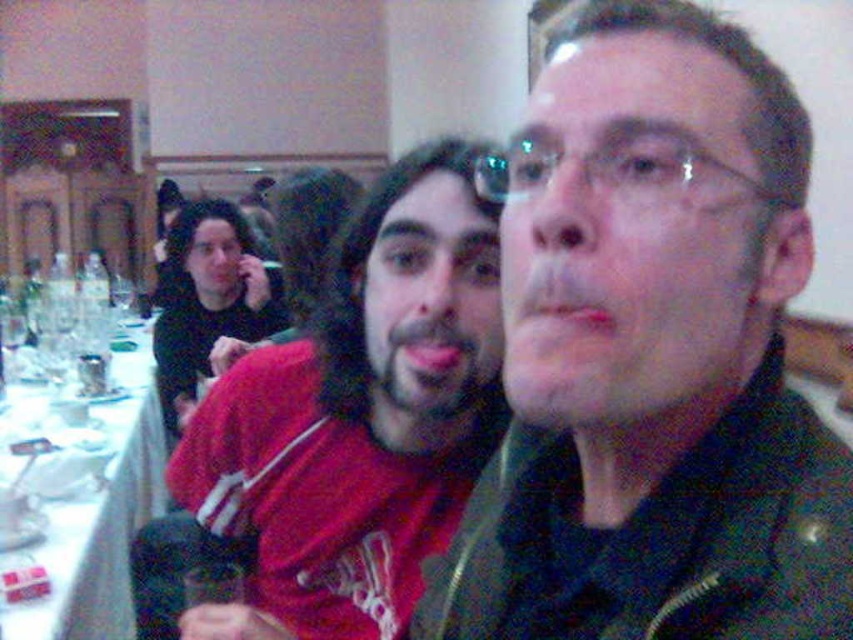
Question: Does white glossy table at left appear on the left side of transparent plastic glasses at center?

Choices:
 (A) no
 (B) yes

Answer: (B)

Question: Which object appears farthest from the camera in this image?

Choices:
 (A) white glossy table at left
 (B) transparent plastic glasses at center

Answer: (A)

Question: Can you confirm if matte black jacket at center is bigger than transparent plastic glasses at center?

Choices:
 (A) yes
 (B) no

Answer: (A)

Question: Which object is farther from the camera taking this photo?

Choices:
 (A) matte black jacket at center
 (B) transparent plastic glasses at center
 (C) red matte shirt at center

Answer: (C)

Question: Which point is closer to the camera?

Choices:
 (A) matte black jacket at center
 (B) transparent plastic glasses at center
 (C) white glossy table at left

Answer: (A)

Question: Can you confirm if red matte shirt at center is positioned below white glossy table at left?

Choices:
 (A) no
 (B) yes

Answer: (A)